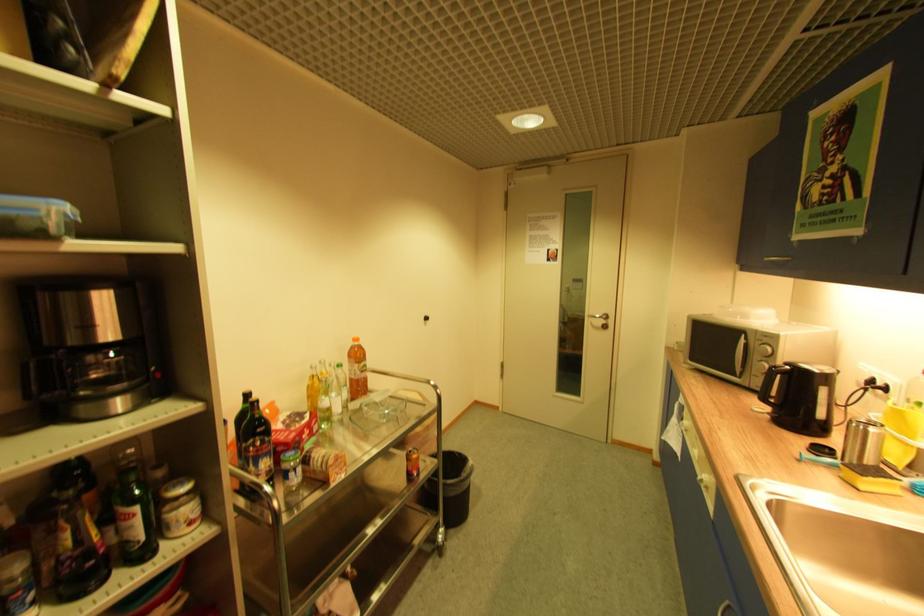
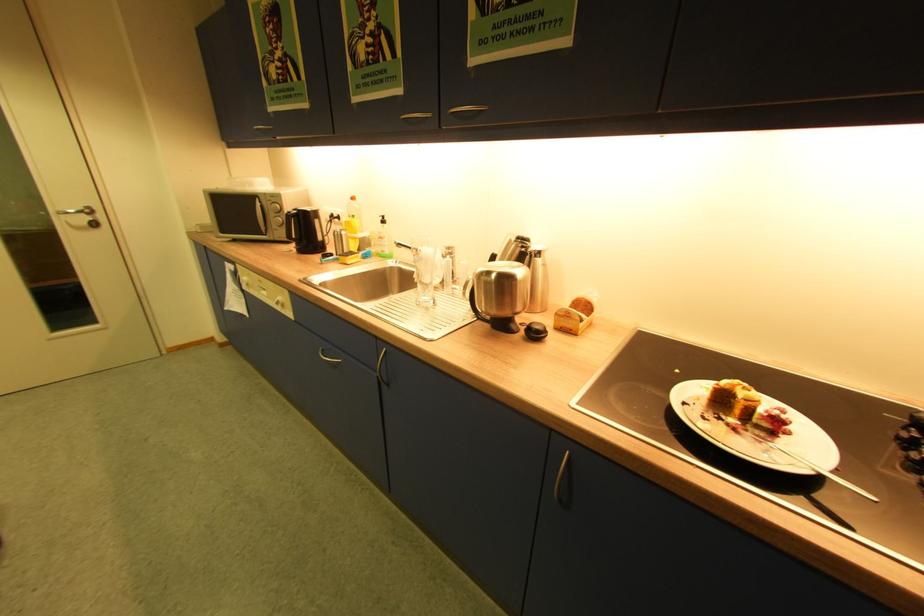
Where in the second image is the point corresponding to (x=597, y=323) from the first image?

(74, 224)